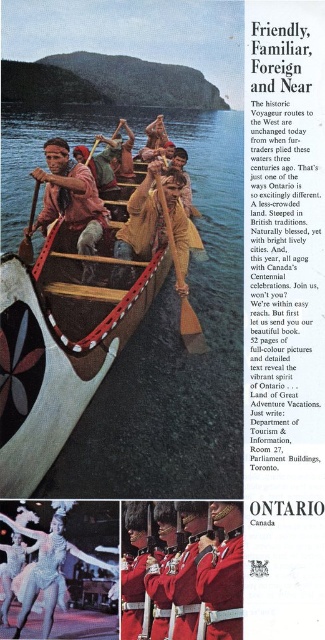
From the picture: Which is above, brown wooden canoe at center or wooden paddle at center?

wooden paddle at center is higher up.

Can you confirm if brown wooden canoe at center is thinner than wooden paddle at center?

No, brown wooden canoe at center is not thinner than wooden paddle at center.

Identify the location of brown wooden canoe at center. (67, 333).

Image resolution: width=325 pixels, height=640 pixels. I want to click on brown wooden canoe at center, so click(67, 333).

Is leather jacket at center thinner than red woolen hat at center?

Incorrect, leather jacket at center's width is not less than red woolen hat at center's.

From the picture: Between leather jacket at center and red woolen hat at center, which one is positioned higher?

leather jacket at center is above.

Is point (158, 168) behind point (223, 573)?

Yes, it is.

Find the location of `leather jacket at center`. leather jacket at center is located at coordinates (155, 220).

Does shiny silver dress at center have a lesser height compared to rustic wood canoe at center?

Indeed, shiny silver dress at center has a lesser height compared to rustic wood canoe at center.

This screenshot has height=640, width=325. What do you see at coordinates (57, 570) in the screenshot? I see `shiny silver dress at center` at bounding box center [57, 570].

This screenshot has height=640, width=325. What do you see at coordinates (57, 570) in the screenshot? I see `shiny silver dress at center` at bounding box center [57, 570].

The width and height of the screenshot is (325, 640). What are the coordinates of `shiny silver dress at center` in the screenshot? It's located at pyautogui.click(x=57, y=570).